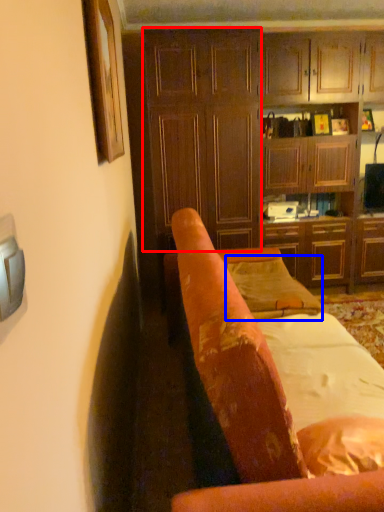
Question: Which of the following is the farthest to the observer, dresser (highlighted by a red box) or pillow (highlighted by a blue box)?

Choices:
 (A) dresser
 (B) pillow

Answer: (A)